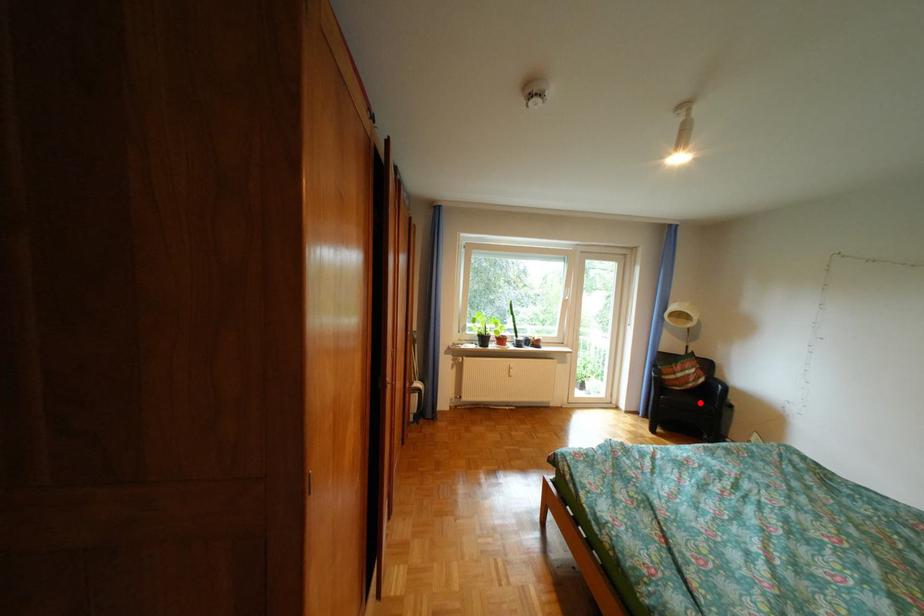
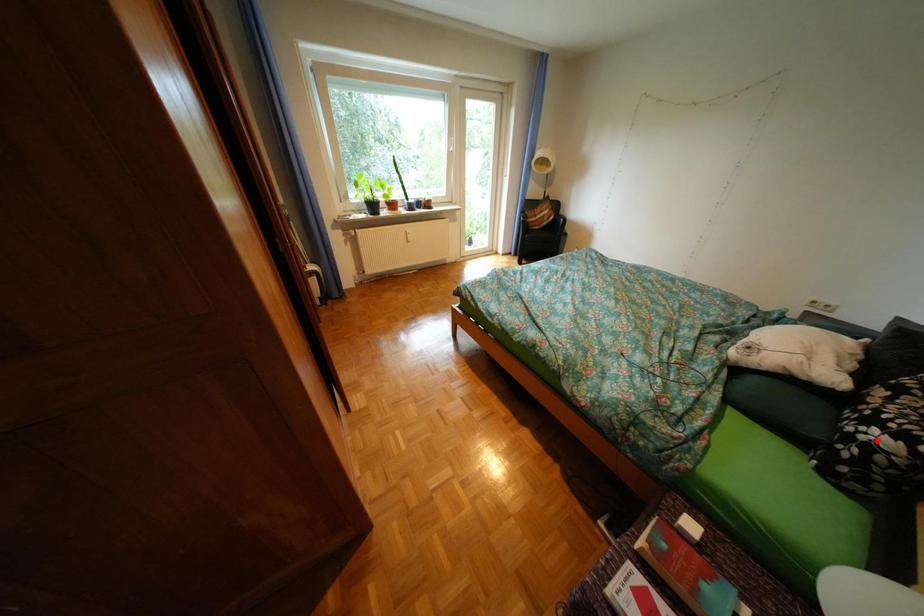
I am providing you with two images of the same scene from different viewpoints. A red point is marked on the first image and another point is marked on the second image. Is the marked point in image1 the same physical position as the marked point in image2?

No